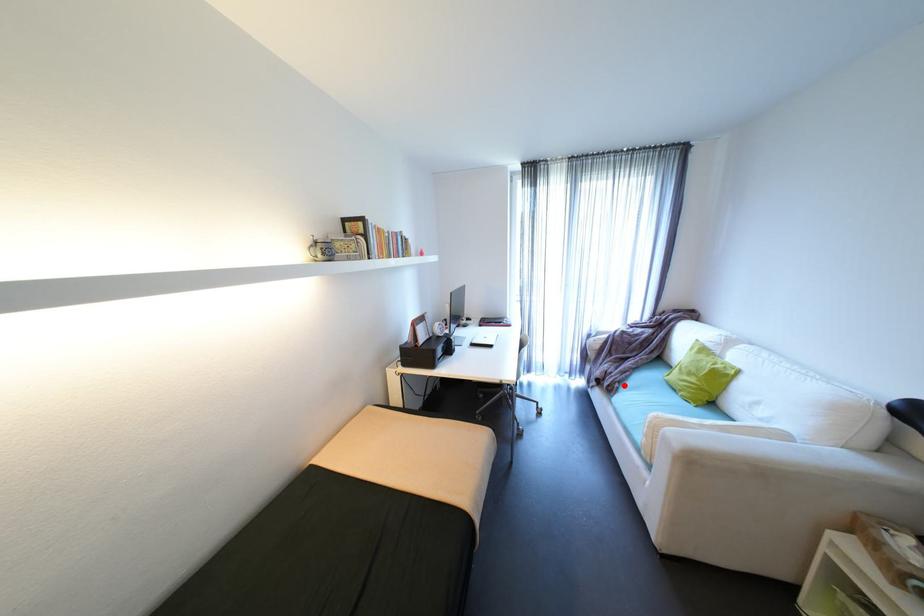
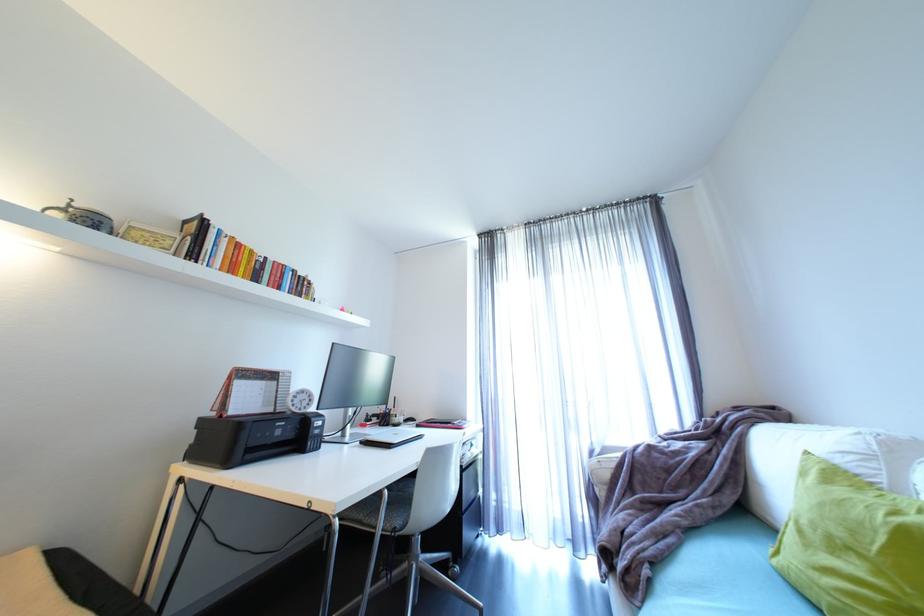
In the second image, find the point that corresponds to the highlighted location in the first image.

(653, 572)